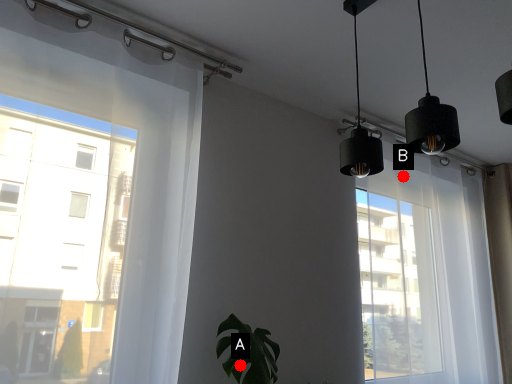
Question: Two points are circled on the image, labeled by A and B beside each circle. Which point appears closest to the camera in this image?

Choices:
 (A) A is closer
 (B) B is closer

Answer: (A)